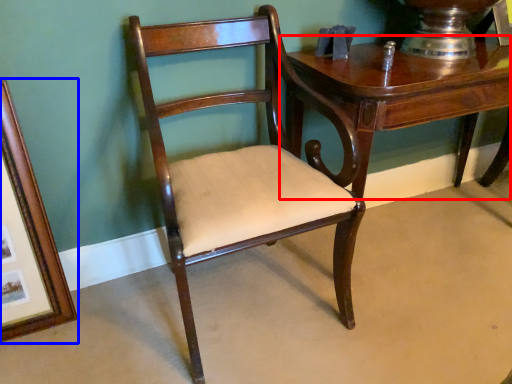
Question: Which of the following is the closest to the observer, table (highlighted by a red box) or picture frame (highlighted by a blue box)?

Choices:
 (A) table
 (B) picture frame

Answer: (B)